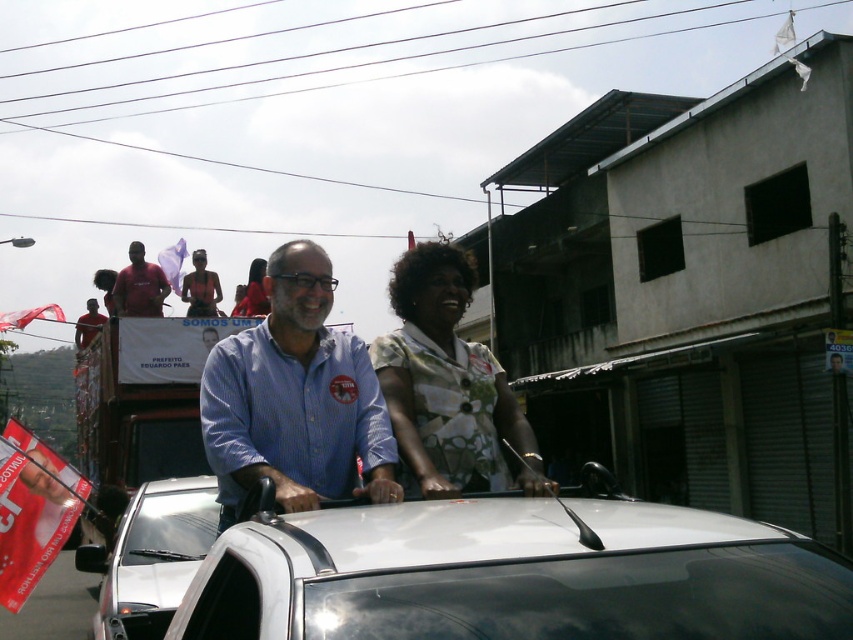
You are a photographer trying to capture a wide shot of the event. You need to include both the white glossy car at center and the silver metallic car at center in your frame. Given that your camera has a fixed focal length, which car should you position closer to the edge of the frame to avoid cropping either vehicle?

You should position the white glossy car at center closer to the edge of the frame because it is wider than the silver metallic car at center, requiring more space in the frame to avoid cropping.

You are a photographer trying to capture a photo of the event. You notice the floral fabric blouse at center and the matte black shirt at center. Which one is closer to the camera?

The floral fabric blouse at center is positioned under the matte black shirt at center, so the matte black shirt at center is closer to the camera.

You are a photographer at the event and want to take a photo of the two people at the center. The camera you are using has a focus range that can only capture objects up to 1.5 meters tall. Which of the two, the floral fabric blouse at center or the matte black shirt at center, will be in focus if you aim the camera at their chests?

The floral fabric blouse at center is shorter than the matte black shirt at center. Since the camera can only focus on objects up to 1.5 meters tall, the floral fabric blouse at center will be in focus while the matte black shirt at center may be out of focus if it exceeds the height limit.